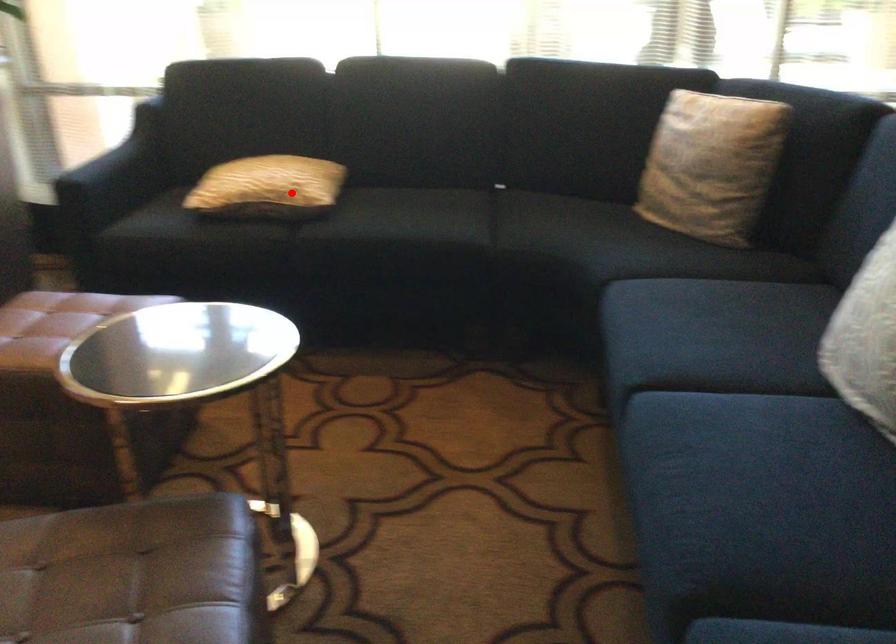
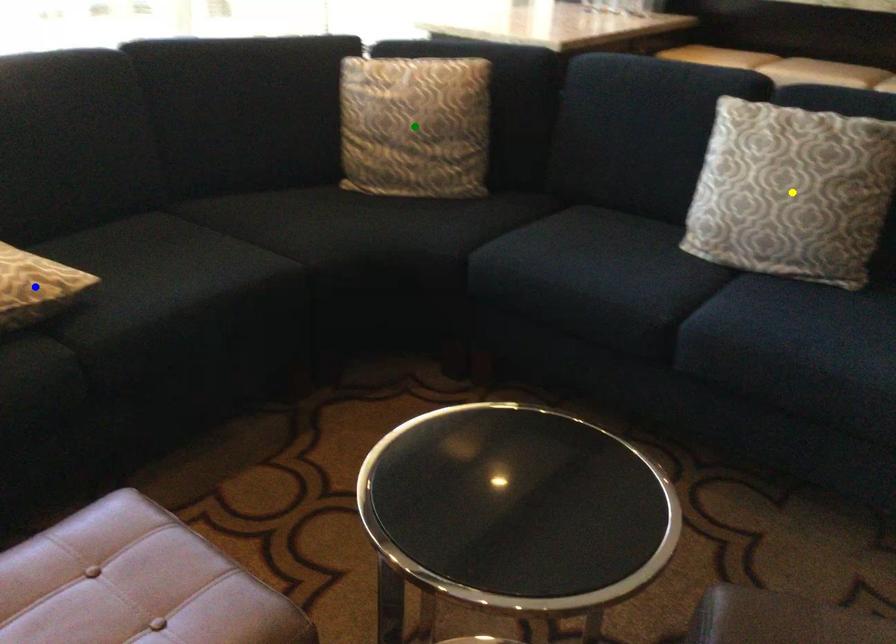
Question: I am providing you with two images of the same scene from different viewpoints. A red point is marked on the first image. You are given multiple points on the second image. Can you choose the point in image 2 that corresponds to the point in image 1?

Choices:
 (A) yellow point
 (B) blue point
 (C) green point

Answer: (B)